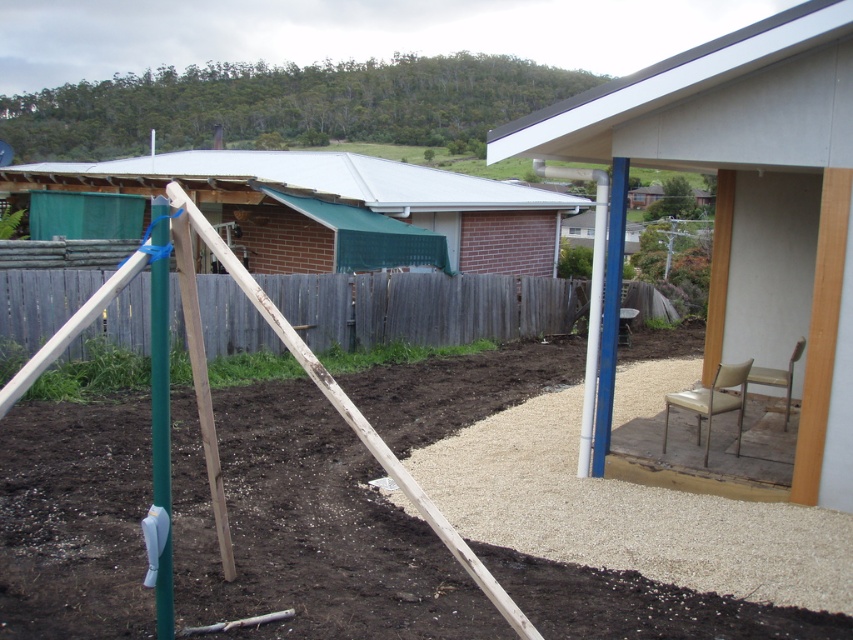
Question: Is the position of smooth white wall at upper right more distant than that of gray wood fence at center?

Choices:
 (A) yes
 (B) no

Answer: (B)

Question: Which of the following is the closest to the observer?

Choices:
 (A) metal/brick hut at upper left
 (B) green matte pole at left
 (C) beige fabric chair at lower right
 (D) leather-like beige chair at lower right

Answer: (B)

Question: Which is nearer to the gray wood fence at center?

Choices:
 (A) white plastic pole at right
 (B) smooth white wall at upper right
 (C) brown gravel at lower center
 (D) leather-like beige chair at lower right

Answer: (A)

Question: Is brown gravel at lower center above leather-like beige chair at lower right?

Choices:
 (A) no
 (B) yes

Answer: (A)

Question: Can you confirm if smooth white wall at upper right is positioned to the right of metal/brick hut at upper left?

Choices:
 (A) yes
 (B) no

Answer: (A)

Question: Which of the following is the closest to the observer?

Choices:
 (A) (608, 467)
 (B) (583, 196)
 (C) (693, 403)

Answer: (A)